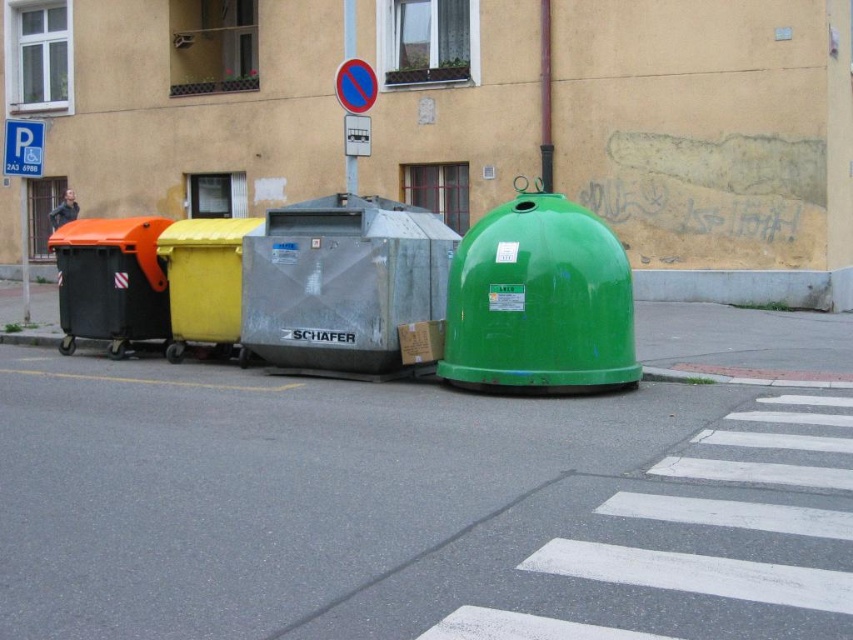
Is green matte recycling bin at center below metallic gray recycling bin at center?

Yes.

Which of these two, green matte recycling bin at center or metallic gray recycling bin at center, stands shorter?

green matte recycling bin at center is shorter.

The width and height of the screenshot is (853, 640). Describe the element at coordinates (538, 300) in the screenshot. I see `green matte recycling bin at center` at that location.

Where is `green matte recycling bin at center`? Image resolution: width=853 pixels, height=640 pixels. green matte recycling bin at center is located at coordinates (538, 300).

Measure the distance between green matte recycling bin at center and orange plastic recycling bin at left.

The distance of green matte recycling bin at center from orange plastic recycling bin at left is 17.03 feet.

Can you confirm if green matte recycling bin at center is positioned below orange plastic recycling bin at left?

Correct, green matte recycling bin at center is located below orange plastic recycling bin at left.

Find the location of `green matte recycling bin at center`. green matte recycling bin at center is located at coordinates (538, 300).

Who is lower down, metallic gray recycling bin at center or orange plastic recycling bin at left?

Positioned lower is metallic gray recycling bin at center.

Can you confirm if metallic gray recycling bin at center is positioned to the left of orange plastic recycling bin at left?

No, metallic gray recycling bin at center is not to the left of orange plastic recycling bin at left.

Who is more distant from viewer, (x=373, y=330) or (x=137, y=339)?

The point (x=137, y=339) is behind.

Where is `metallic gray recycling bin at center`? This screenshot has width=853, height=640. metallic gray recycling bin at center is located at coordinates 341,282.